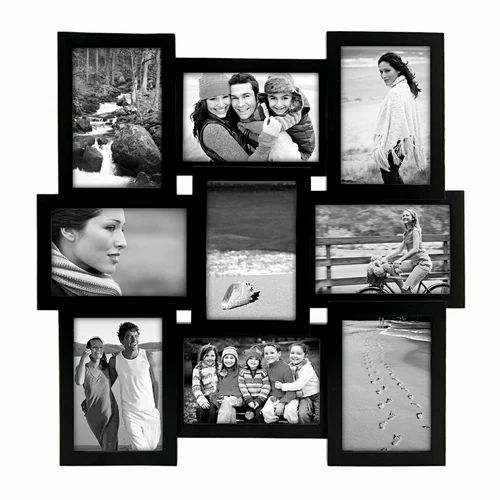
Identify the location of pictures in collage. (115, 140), (245, 127), (394, 253), (372, 141), (255, 282), (124, 255), (139, 362), (235, 369), (382, 393).